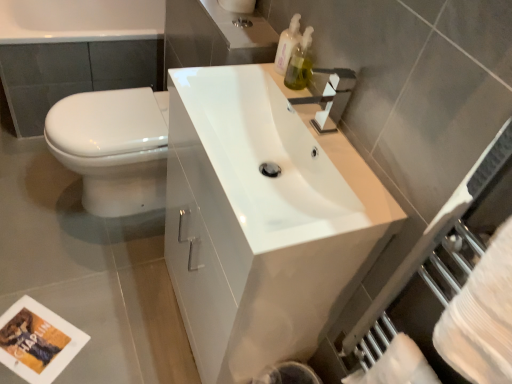
Identify the location of free space to the left of white glossy toilet at left. The height and width of the screenshot is (384, 512). (28, 180).